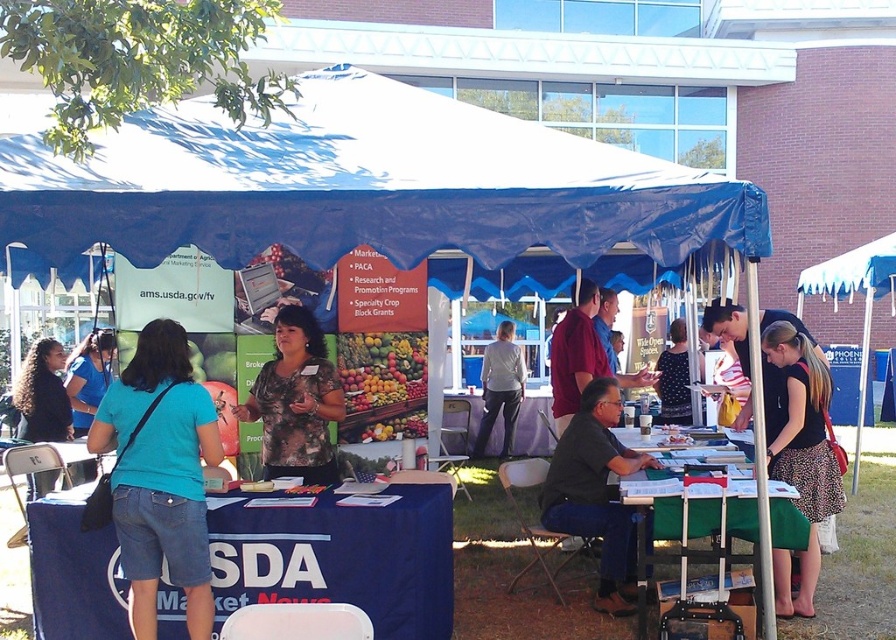
You are a visitor at the event and want to approach the table to pick up a pamphlet. Which object, the matte red shirt at center or the blue fabric table at center, should you walk towards first?

The matte red shirt at center is in front of the blue fabric table at center, so you should walk towards the matte red shirt at center first to reach the blue fabric table at center.

You are a visitor at the event and want to approach the USDA booth. You see the matte red shirt at center and the blue fabric table at center. Which object should you move towards to reach the booth?

You should move towards the blue fabric table at center because the matte red shirt at center is to the right of it, indicating the booth is centered around the table.

You are a photographer standing at the back of the tent. You want to take a photo of the blue denim shorts at lower left and the matte red shirt at center so that both are clearly visible. Considering their heights, which object should you position closer to the camera to ensure both are visible in the frame?

The blue denim shorts at lower left is much taller than the matte red shirt at center. To ensure both are visible in the frame, you should position the blue denim shorts at lower left closer to the camera so its height doesn